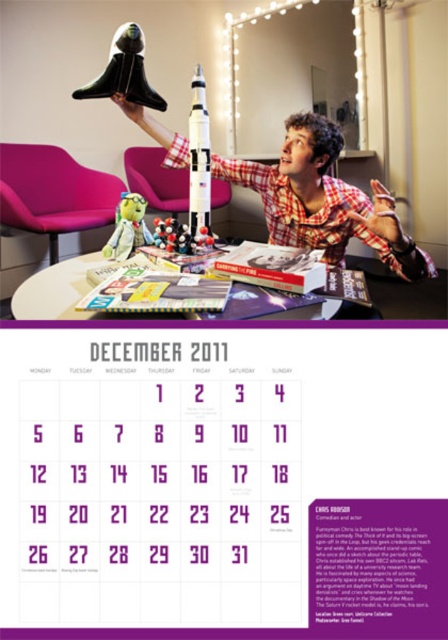
Based on the photo, does white glossy table at center appear under green plush toy at center?

Indeed, white glossy table at center is positioned under green plush toy at center.

Does point (93, 312) come in front of point (129, 230)?

Yes, it is in front of point (129, 230).

The height and width of the screenshot is (640, 448). I want to click on white glossy table at center, so click(56, 291).

Based on the photo, does white glossy table at center appear over black matte rocket ship at upper center?

No, white glossy table at center is not above black matte rocket ship at upper center.

Does white glossy table at center have a larger size compared to black matte rocket ship at upper center?

Yes.

Is point (328, 300) positioned in front of point (133, 90)?

Yes, it is in front of point (133, 90).

You are a GUI agent. You are given a task and a screenshot of the screen. Output one action in this format:
    pyautogui.click(x=<x>, y=<y>)
    Task: Click on the white glossy table at center
    The height and width of the screenshot is (640, 448).
    Given the screenshot: What is the action you would take?
    pyautogui.click(x=56, y=291)

Which is in front, point (390, 236) or point (21, 298)?

Point (21, 298)

Does plaid shirt at upper center have a greater width compared to white glossy table at center?

Correct, the width of plaid shirt at upper center exceeds that of white glossy table at center.

Who is more distant from viewer, [379,250] or [306,317]?

The point [379,250] is more distant.

Find the location of a particular element. Image resolution: width=448 pixels, height=640 pixels. plaid shirt at upper center is located at coordinates (323, 200).